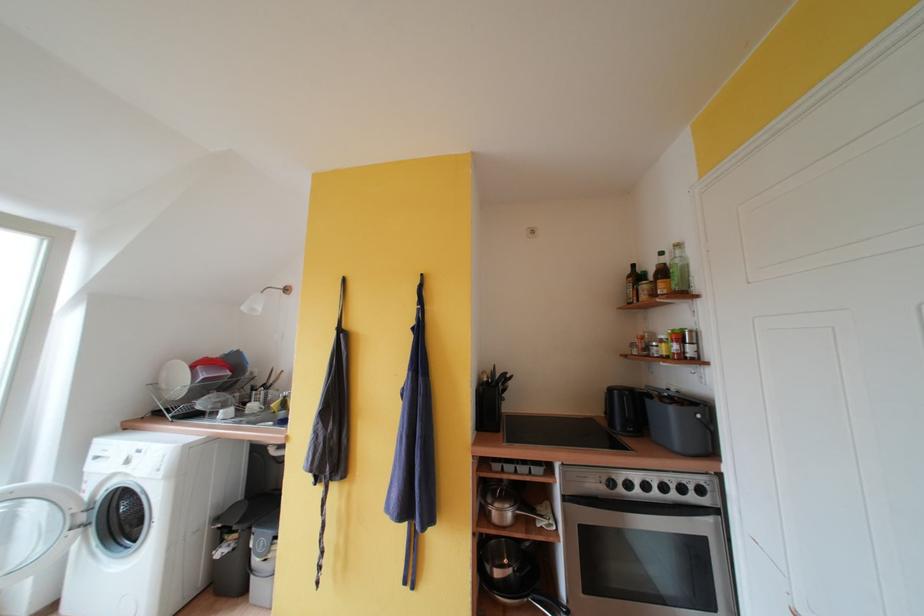
Describe the element at coordinates (35, 527) in the screenshot. I see `the washing machine door` at that location.